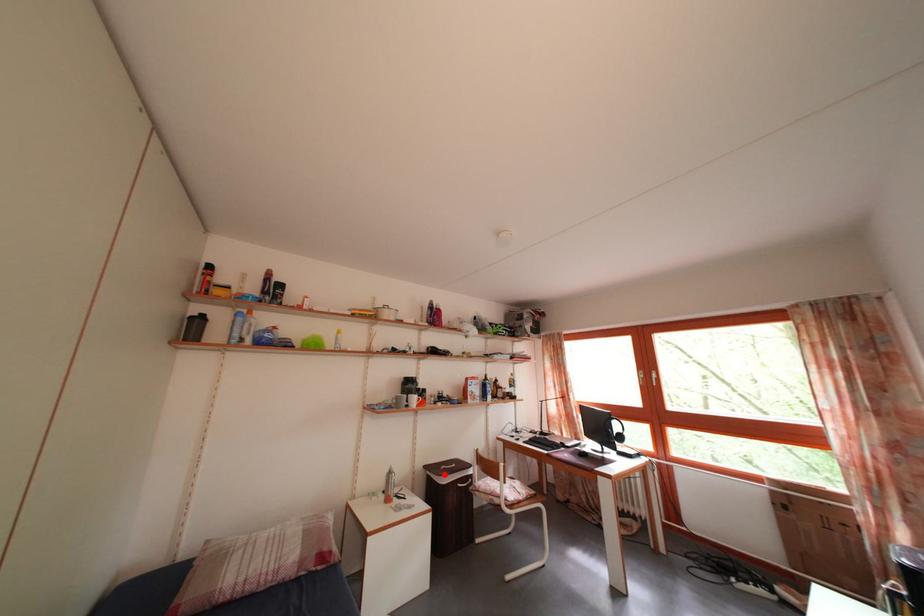
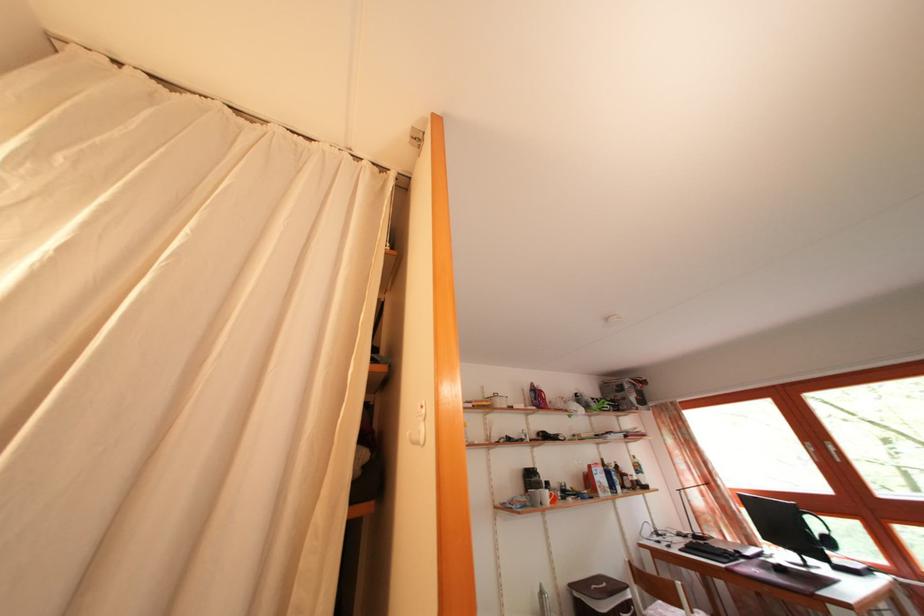
Question: I am providing you with two images of the same scene from different viewpoints. In image1, a red point is highlighted. Considering the same 3D point in image2, which of the following is correct?

Choices:
 (A) It is closer
 (B) It is farther

Answer: (A)